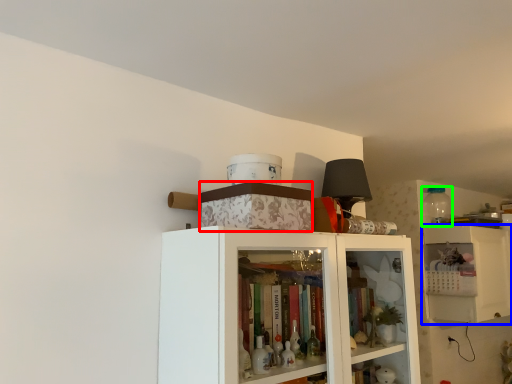
Question: Which object is the farthest from box (highlighted by a red box)? Choose among these: cabinetry (highlighted by a blue box) or bottle (highlighted by a green box).

Choices:
 (A) cabinetry
 (B) bottle

Answer: (B)